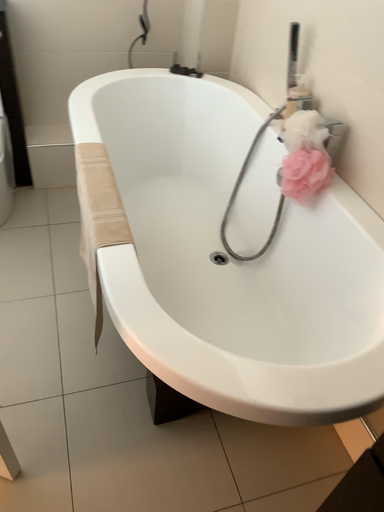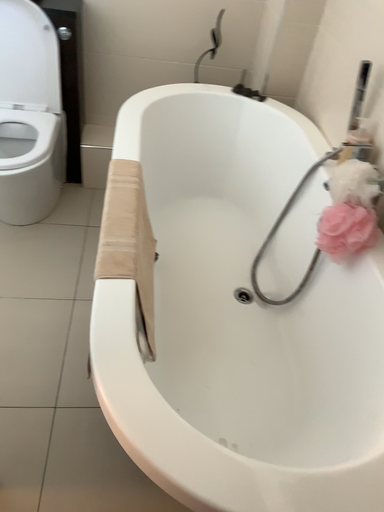
Question: Which way did the camera rotate in the video?

Choices:
 (A) rotated left
 (B) rotated right

Answer: (A)